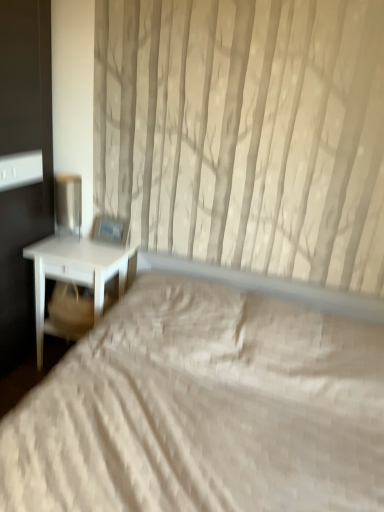
Question: From a real-world perspective, is metallic silver table lamp at left positioned above or below beige fabric swivel chair at left?

Choices:
 (A) below
 (B) above

Answer: (B)

Question: In terms of height, does metallic silver table lamp at left look taller or shorter compared to beige fabric swivel chair at left?

Choices:
 (A) tall
 (B) short

Answer: (A)

Question: Estimate the real-world distances between objects in this image. Which object is farther from the white matte nightstand at left?

Choices:
 (A) metallic silver table lamp at left
 (B) white quilted bed at center
 (C) beige fabric swivel chair at left

Answer: (B)

Question: Estimate the real-world distances between objects in this image. Which object is closer to the white matte nightstand at left?

Choices:
 (A) metallic silver table lamp at left
 (B) beige fabric swivel chair at left
 (C) white quilted bed at center

Answer: (B)